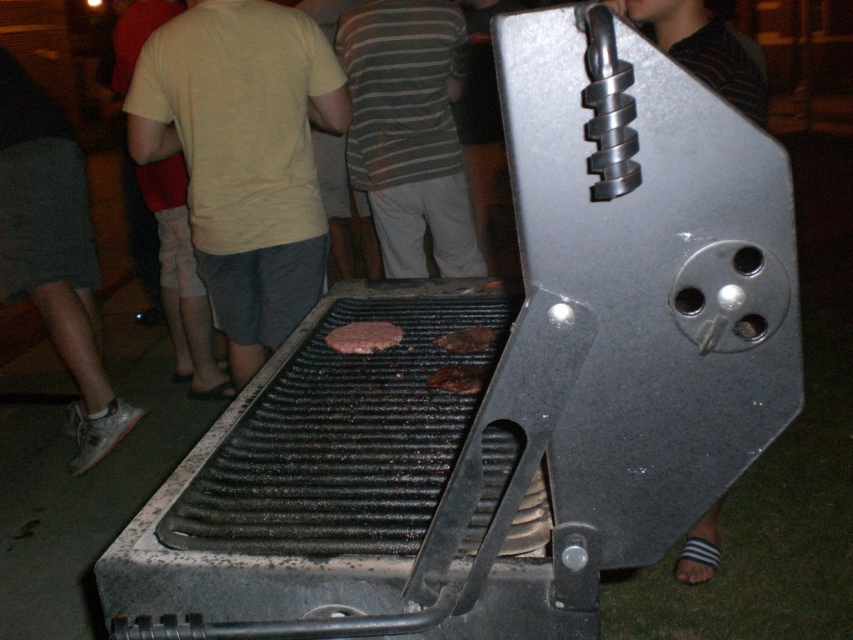
Question: Which point is farther to the camera?

Choices:
 (A) striped fabric shirt at center
 (B) brown charred burger patty at center

Answer: (A)

Question: Which point is closer to the camera?

Choices:
 (A) (440, 372)
 (B) (427, 195)

Answer: (A)

Question: Is matte yellow t-shirt at center in front of brown charred burger patty at center?

Choices:
 (A) no
 (B) yes

Answer: (A)

Question: Considering the relative positions of black matte grill at center and brown charred meat at center in the image provided, where is black matte grill at center located with respect to brown charred meat at center?

Choices:
 (A) above
 (B) below

Answer: (B)

Question: Is brown charred meat at center above brown charred burger patty at center?

Choices:
 (A) yes
 (B) no

Answer: (B)

Question: Which point is farther to the camera?

Choices:
 (A) striped fabric shirt at center
 (B) brown charred meat at center

Answer: (A)